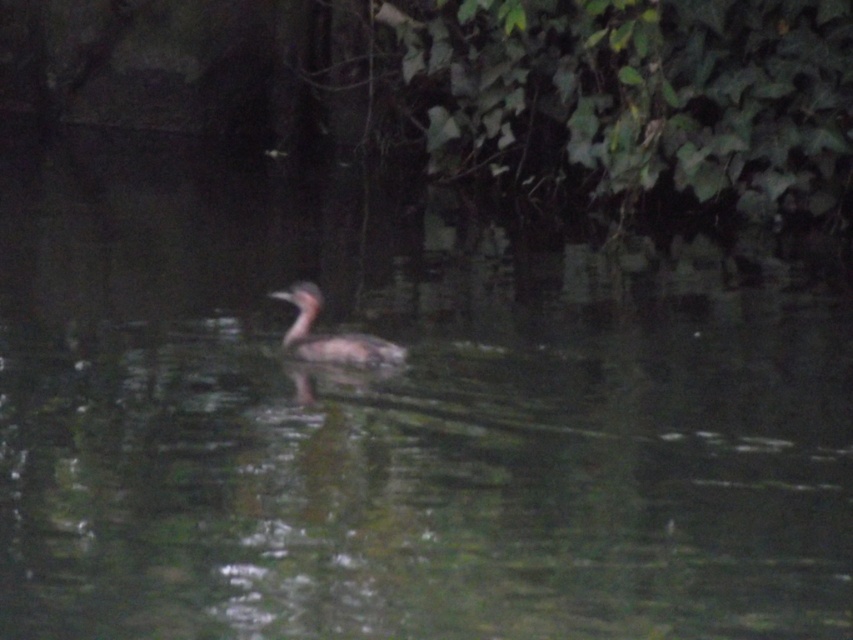
Is green leafy vegetation at upper right closer to the viewer compared to brown speckled duck at center?

No, it is not.

Which of these two, green leafy vegetation at upper right or brown speckled duck at center, stands taller?

Standing taller between the two is green leafy vegetation at upper right.

Who is more forward, (543, 160) or (306, 289)?

Point (306, 289) is in front.

Find the location of a particular element. green leafy vegetation at upper right is located at coordinates 630,97.